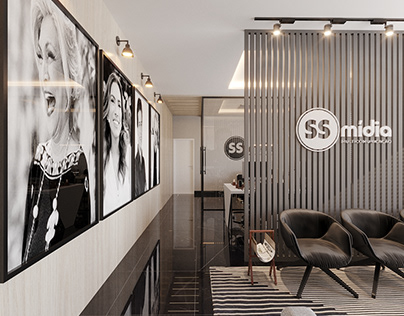
The width and height of the screenshot is (404, 316). Find the location of `picture`. picture is located at coordinates (8, 78).